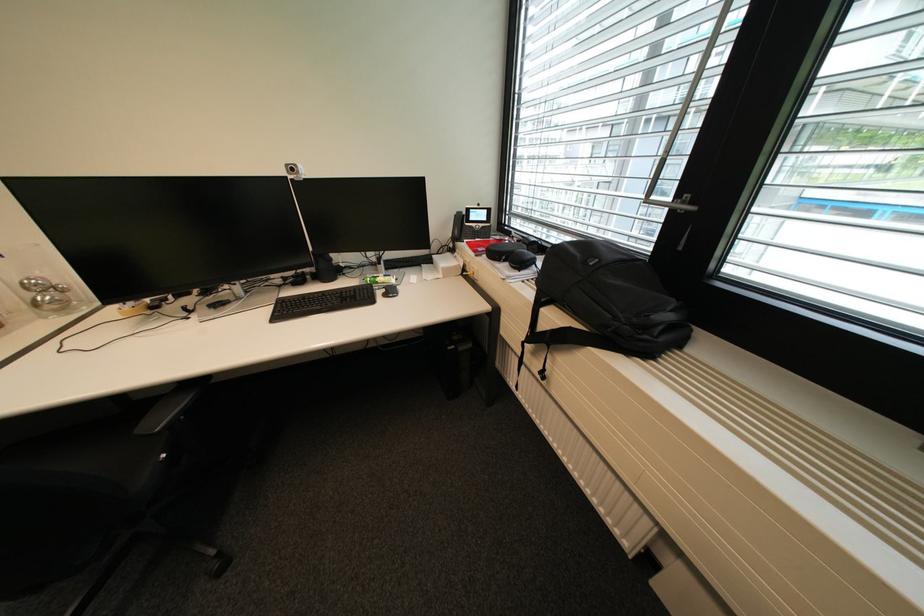
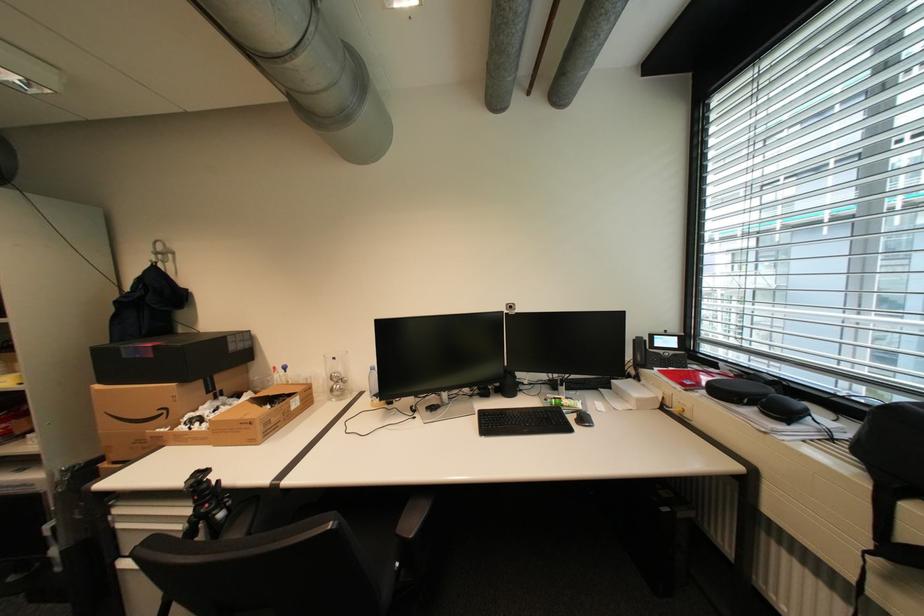
The point at (515,264) is marked in the first image. Where is the corresponding point in the second image?

(763, 410)